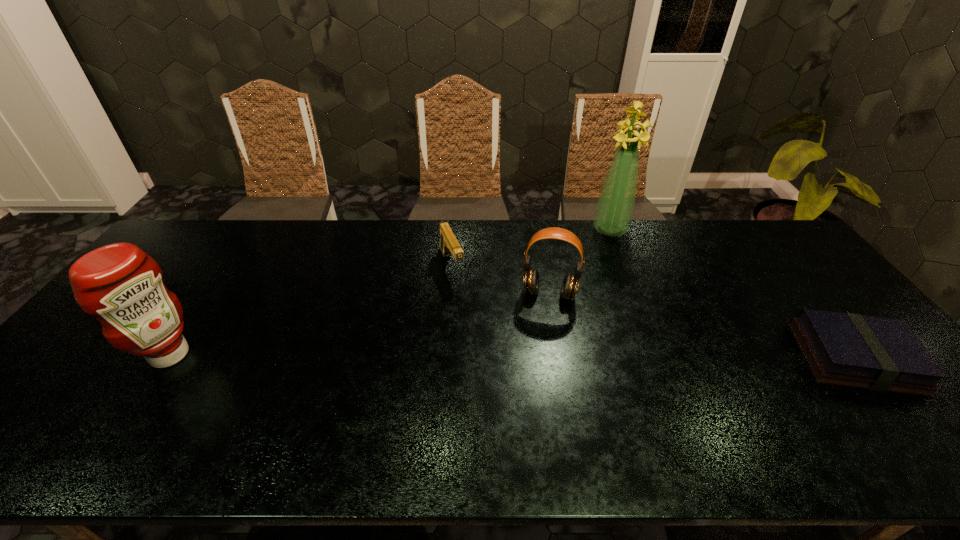
Where is `free space located on the back of the condiment`? The image size is (960, 540). free space located on the back of the condiment is located at coordinates (204, 304).

The width and height of the screenshot is (960, 540). I want to click on free point located on the back of the book, so click(778, 262).

Find the location of a particular element. The height and width of the screenshot is (540, 960). vacant space positioned on the front-facing side of the farthest object is located at coordinates (584, 306).

The width and height of the screenshot is (960, 540). Find the location of `vacant space located on the front-facing side of the farthest object`. vacant space located on the front-facing side of the farthest object is located at coordinates (583, 308).

Where is `vacant region located on the front-facing side of the farthest object`? The height and width of the screenshot is (540, 960). vacant region located on the front-facing side of the farthest object is located at coordinates (602, 255).

Find the location of a particular element. The width and height of the screenshot is (960, 540). free region located at the barrel of the fourth object from right to left is located at coordinates (485, 344).

Identify the location of vacant space located 0.140m at the barrel of the fourth object from right to left. The height and width of the screenshot is (540, 960). (470, 314).

Where is `vacant space located 0.370m at the barrel of the fourth object from right to left`? This screenshot has height=540, width=960. vacant space located 0.370m at the barrel of the fourth object from right to left is located at coordinates click(501, 376).

Where is `vacant space positioned 0.050m on the ear cups of the third object from right to left`? The height and width of the screenshot is (540, 960). vacant space positioned 0.050m on the ear cups of the third object from right to left is located at coordinates (543, 318).

What are the coordinates of `vacant space located on the ear cups of the third object from right to left` in the screenshot? It's located at (533, 382).